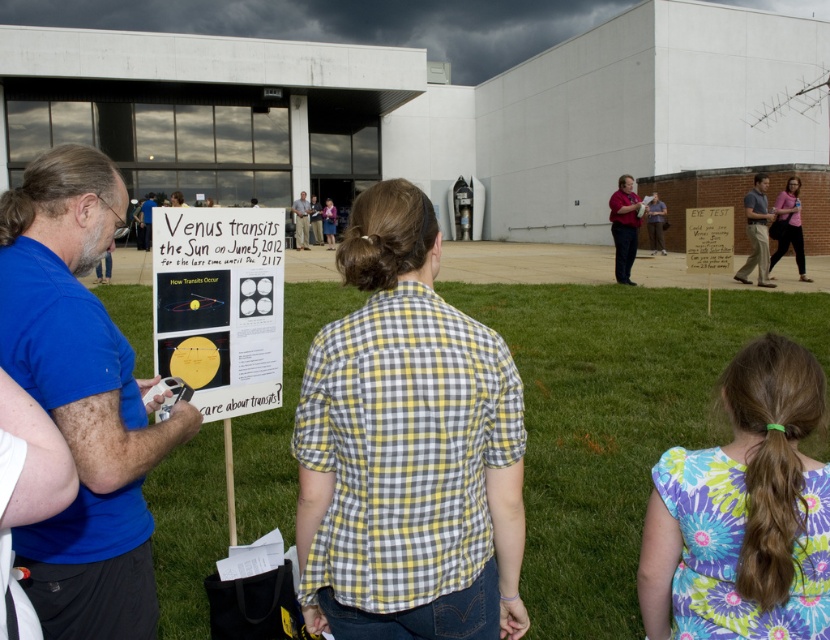
Question: Which point is closer to the camera taking this photo?

Choices:
 (A) (138, 449)
 (B) (780, 198)

Answer: (A)

Question: Is green grass at center below white paper at center?

Choices:
 (A) yes
 (B) no

Answer: (A)

Question: Which point is farther to the camera?

Choices:
 (A) (57, 637)
 (B) (213, 461)
 (C) (797, 177)
 (D) (212, 362)

Answer: (C)

Question: Is yellow checkered shirt at center bigger than white paper at center?

Choices:
 (A) yes
 (B) no

Answer: (A)

Question: Can you confirm if blue shirt at left is positioned below matte red shirt at center?

Choices:
 (A) yes
 (B) no

Answer: (A)

Question: Which of the following is the farthest from the observer?

Choices:
 (A) (301, 228)
 (B) (328, 220)

Answer: (B)